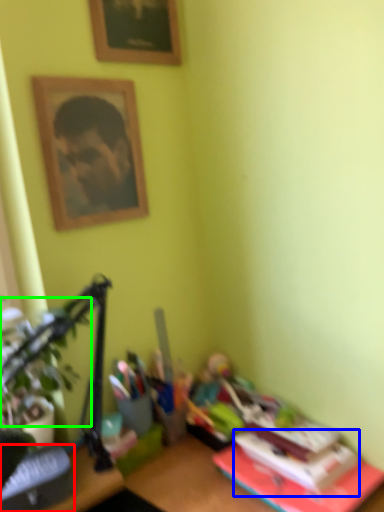
Question: Which object is the farthest from paperback book (highlighted by a red box)? Choose among these: paperback book (highlighted by a blue box) or plant (highlighted by a green box).

Choices:
 (A) paperback book
 (B) plant

Answer: (A)